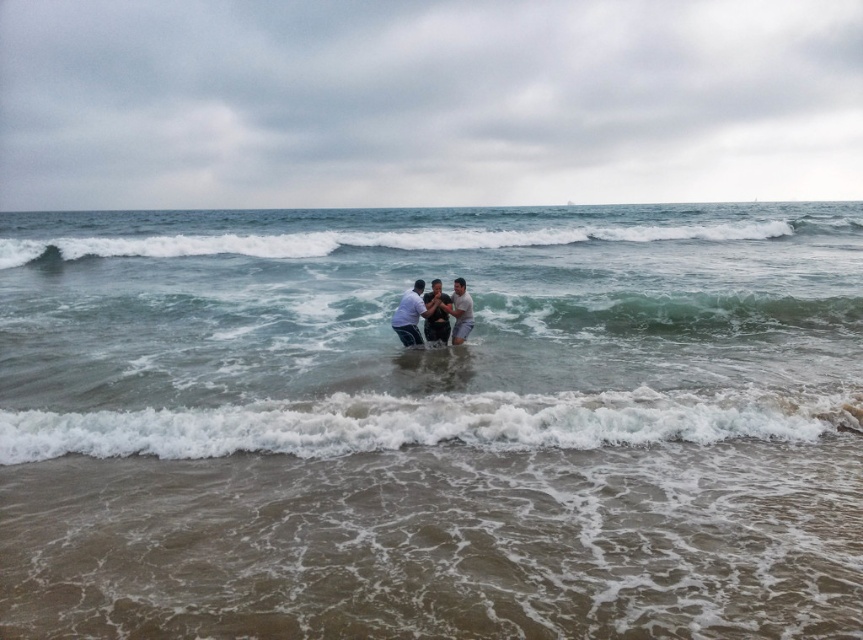
Is clear water at center smaller than smooth skin man at center?

Incorrect, clear water at center is not smaller in size than smooth skin man at center.

Does clear water at center have a greater width compared to smooth skin man at center?

Indeed, clear water at center has a greater width compared to smooth skin man at center.

Where is `clear water at center`? Image resolution: width=863 pixels, height=640 pixels. clear water at center is located at coordinates (432, 424).

You are a GUI agent. You are given a task and a screenshot of the screen. Output one action in this format:
    pyautogui.click(x=<x>, y=<y>)
    Task: Click on the clear water at center
    This screenshot has height=640, width=863.
    Given the screenshot: What is the action you would take?
    pyautogui.click(x=432, y=424)

Is clear water at center to the left of white foamy wave at lower center from the viewer's perspective?

Indeed, clear water at center is positioned on the left side of white foamy wave at lower center.

Does clear water at center have a greater height compared to white foamy wave at lower center?

Indeed, clear water at center has a greater height compared to white foamy wave at lower center.

Between point (222, 289) and point (735, 435), which one is positioned behind?

Positioned behind is point (222, 289).

Identify the location of clear water at center. The height and width of the screenshot is (640, 863). 432,424.

Who is positioned more to the left, smooth skin man at center or light gray fabric man at center?

smooth skin man at center is more to the left.

Who is more forward, (x=446, y=337) or (x=457, y=324)?

Positioned in front is point (x=457, y=324).

Is point (446, 296) positioned after point (468, 300)?

Yes, point (446, 296) is farther from viewer.

This screenshot has height=640, width=863. What are the coordinates of `smooth skin man at center` in the screenshot? It's located at (436, 326).